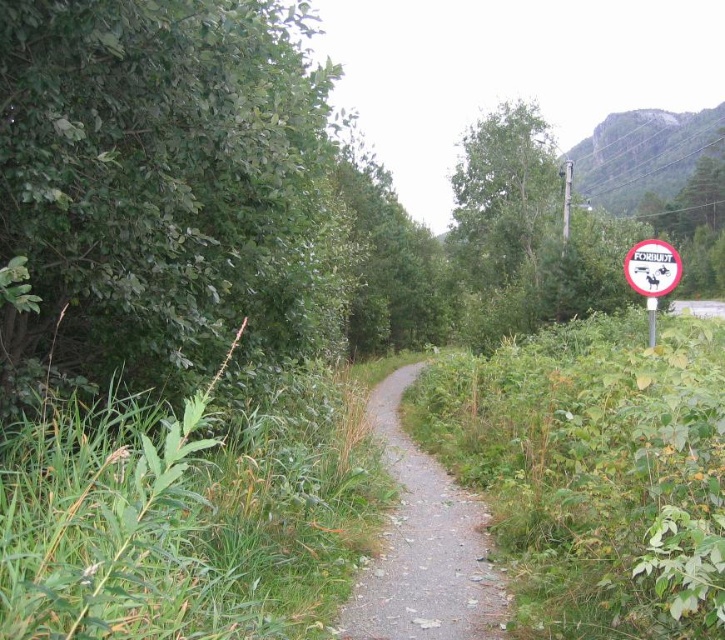
You are standing at the start of the path and want to walk to the circular sign on the right. Which object, the green leafy tree at left or the circular sign on the right, is closer to your starting position?

The green leafy tree at left is closer to your starting position because it is located at point (x=161, y=188), which is nearer than the circular sign on the right.

You are a hiker carrying a 15 meter long tent pole. You need to set up camp along the path between the green leafy tree at left and the green leafy tree at center. Can you find a spot where the distance between these two trees is sufficient to place your tent pole horizontally without bending it?

The distance between the green leafy tree at left and green leafy tree at center is 14.35 meters, which is shorter than the 15 meter long tent pole. Therefore, there is no spot along the path where the distance between these two trees is sufficient to place your tent pole horizontally without bending it.